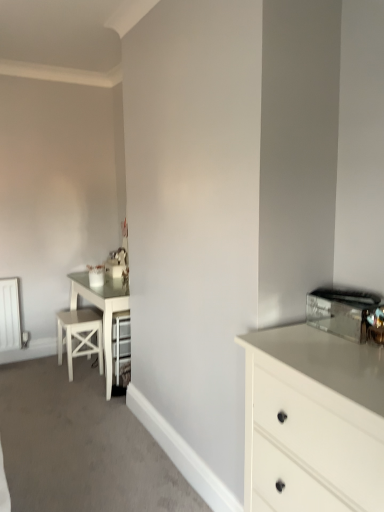
Question: Considering the positions of point (61, 339) and point (349, 330), is point (61, 339) closer or farther from the camera than point (349, 330)?

Choices:
 (A) closer
 (B) farther

Answer: (B)

Question: Looking at their shapes, would you say white wood bar stool at left is wider or thinner than shiny metallic toaster at upper right?

Choices:
 (A) wide
 (B) thin

Answer: (A)

Question: Which of these objects is positioned closest to the white glossy chest of drawers at right?

Choices:
 (A) shiny metallic toaster at upper right
 (B) white wood bar stool at left

Answer: (A)

Question: Which is farther from the white glossy chest of drawers at right?

Choices:
 (A) white wood bar stool at left
 (B) shiny metallic toaster at upper right

Answer: (A)